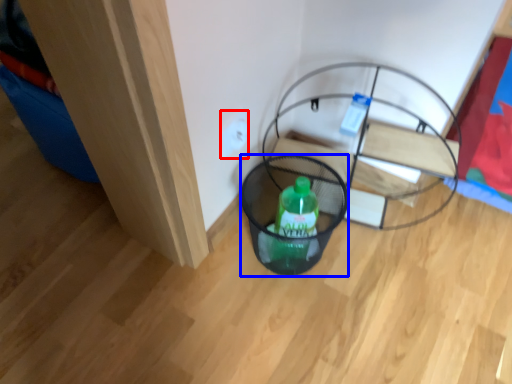
Question: Which object is closer to the camera taking this photo, electric outlet (highlighted by a red box) or basket (highlighted by a blue box)?

Choices:
 (A) electric outlet
 (B) basket

Answer: (B)